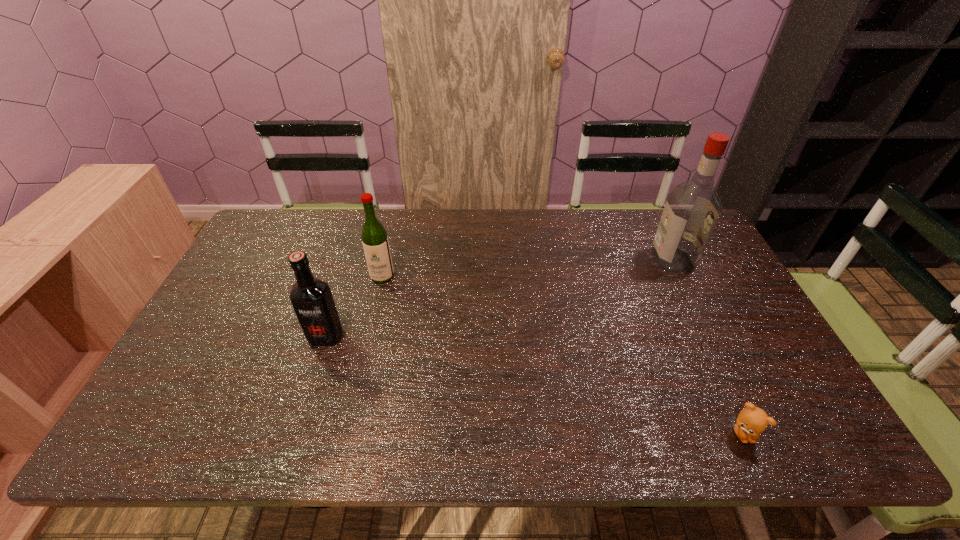
Locate an element on the screen. This screenshot has width=960, height=540. free space located on the label of the second liquor from right to left is located at coordinates (365, 351).

Locate an element on the screen. vacant space located on the front-facing side of the nearest liquor is located at coordinates (316, 366).

I want to click on object located at the far edge, so click(x=692, y=208).

Locate an element on the screen. The image size is (960, 540). object located in the near edge section of the desktop is located at coordinates (752, 421).

The height and width of the screenshot is (540, 960). I want to click on liquor that is positioned at the right edge, so click(x=692, y=208).

Locate an element on the screen. This screenshot has width=960, height=540. teddy bear that is at the right edge is located at coordinates (752, 421).

Image resolution: width=960 pixels, height=540 pixels. What are the coordinates of `object that is positioned at the far right corner` in the screenshot? It's located at (692, 208).

The image size is (960, 540). In order to click on object that is at the near right corner in this screenshot , I will do `click(752, 421)`.

Where is `free space at the far edge of the desktop`? This screenshot has height=540, width=960. free space at the far edge of the desktop is located at coordinates (520, 217).

The width and height of the screenshot is (960, 540). I want to click on free region at the near edge of the desktop, so click(x=579, y=435).